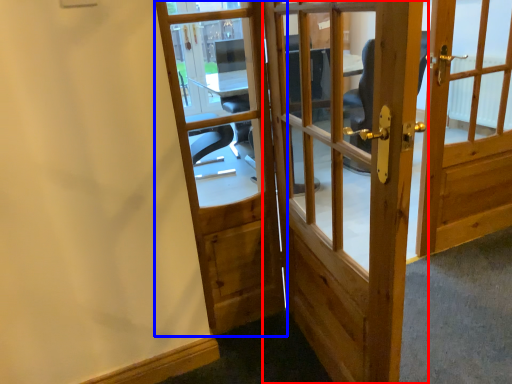
Question: Which of the following is the closest to the observer, door (highlighted by a red box) or door (highlighted by a blue box)?

Choices:
 (A) door
 (B) door

Answer: (A)